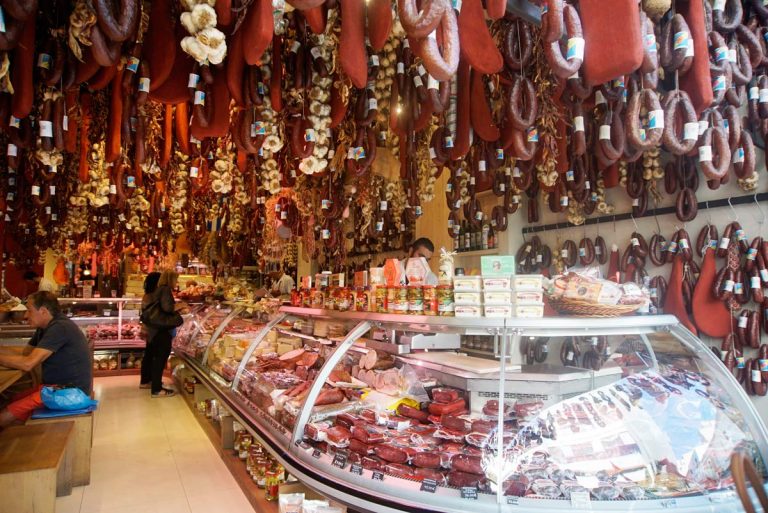
What are the coordinates of `wooden bench` in the screenshot? It's located at (42, 449).